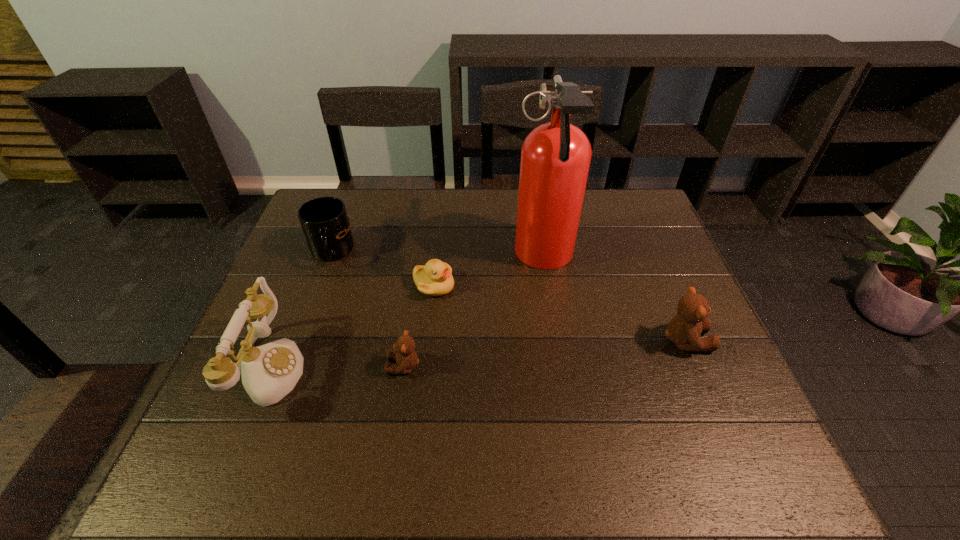
You are a GUI agent. You are given a task and a screenshot of the screen. Output one action in this format:
    pyautogui.click(x=<x>, y=<y>)
    Task: Click on the shorter teddy bear
    The height and width of the screenshot is (540, 960).
    Given the screenshot: What is the action you would take?
    pyautogui.click(x=406, y=358)

At what (x,y) coordinates should I click in order to perform the action: click on the rightmost object. Please return your answer as a coordinate pair (x, y). Looking at the image, I should click on (684, 330).

Where is `the taller teddy bear`? the taller teddy bear is located at coordinates (684, 330).

Where is `mug`? Image resolution: width=960 pixels, height=540 pixels. mug is located at coordinates (324, 220).

Where is `the tallest object`? the tallest object is located at coordinates (555, 157).

The image size is (960, 540). Find the location of `the second object from right to left`. the second object from right to left is located at coordinates (555, 157).

Find the location of a particular element. The width and height of the screenshot is (960, 540). duckling is located at coordinates (435, 278).

Image resolution: width=960 pixels, height=540 pixels. In order to click on telephone in this screenshot , I will do `click(269, 372)`.

You are a GUI agent. You are given a task and a screenshot of the screen. Output one action in this format:
    pyautogui.click(x=<x>, y=<y>)
    Task: Click on the vacant space located on the face of the left teddy bear
    
    Given the screenshot: What is the action you would take?
    pyautogui.click(x=260, y=366)

Where is `vacant region located 0.080m on the face of the left teddy bear`? This screenshot has height=540, width=960. vacant region located 0.080m on the face of the left teddy bear is located at coordinates (352, 366).